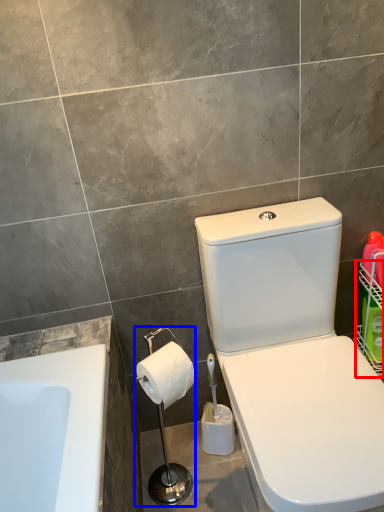
Question: Which of the following is the closest to the observer, basket (highlighted by a red box) or shower (highlighted by a blue box)?

Choices:
 (A) basket
 (B) shower

Answer: (B)